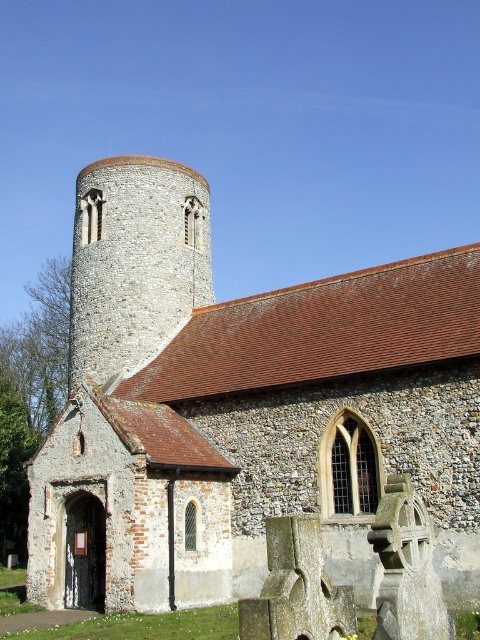
Is stone church at center smaller than stone tower at center?

Actually, stone church at center might be larger than stone tower at center.

Is point (134, 576) closer to viewer compared to point (84, 228)?

Yes, point (134, 576) is closer to viewer.

What do you see at coordinates (243, 408) in the screenshot? The image size is (480, 640). I see `stone church at center` at bounding box center [243, 408].

In order to click on stone church at center in this screenshot , I will do `click(243, 408)`.